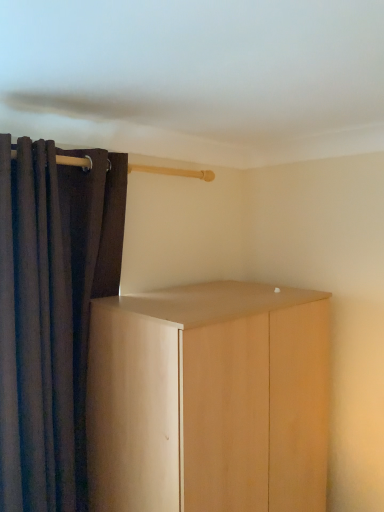
The image size is (384, 512). What are the coordinates of `dark fabric curtain at left` in the screenshot? It's located at (52, 312).

The height and width of the screenshot is (512, 384). What do you see at coordinates (52, 312) in the screenshot?
I see `dark fabric curtain at left` at bounding box center [52, 312].

Where is `light wood cupboard at center`? Image resolution: width=384 pixels, height=512 pixels. light wood cupboard at center is located at coordinates (209, 399).

From the picture: What is the approximate width of light wood cupboard at center?

The width of light wood cupboard at center is 22.03 inches.

What do you see at coordinates (209, 399) in the screenshot? This screenshot has width=384, height=512. I see `light wood cupboard at center` at bounding box center [209, 399].

This screenshot has width=384, height=512. I want to click on dark fabric curtain at left, so click(x=52, y=312).

Considering the relative positions of dark fabric curtain at left and light wood cupboard at center in the image provided, is dark fabric curtain at left to the right of light wood cupboard at center from the viewer's perspective?

In fact, dark fabric curtain at left is to the left of light wood cupboard at center.

Is dark fabric curtain at left closer to the viewer compared to light wood cupboard at center?

No, it is behind light wood cupboard at center.

Is point (63, 334) closer or farther from the camera than point (264, 446)?

Point (63, 334) is closer to the camera than point (264, 446).

From the image's perspective, which object appears higher, dark fabric curtain at left or light wood cupboard at center?

dark fabric curtain at left.

From a real-world perspective, is dark fabric curtain at left positioned over light wood cupboard at center based on gravity?

Yes, from a real-world perspective, dark fabric curtain at left is on top of light wood cupboard at center.

Considering the relative sizes of dark fabric curtain at left and light wood cupboard at center in the image provided, is dark fabric curtain at left thinner than light wood cupboard at center?

Yes.

Which of these two, dark fabric curtain at left or light wood cupboard at center, stands taller?

dark fabric curtain at left is taller.

In terms of size, does dark fabric curtain at left appear bigger or smaller than light wood cupboard at center?

dark fabric curtain at left is smaller than light wood cupboard at center.

Is dark fabric curtain at left surrounding light wood cupboard at center?

No, dark fabric curtain at left does not contain light wood cupboard at center.

Is dark fabric curtain at left next to light wood cupboard at center and touching it?

No, dark fabric curtain at left is not making contact with light wood cupboard at center.

Is light wood cupboard at center at the back of dark fabric curtain at left?

No, dark fabric curtain at left's orientation is not away from light wood cupboard at center.

Can you tell me how much dark fabric curtain at left and light wood cupboard at center differ in facing direction?

The angle between the facing direction of dark fabric curtain at left and the facing direction of light wood cupboard at center is 0.367 degrees.

How much distance is there between dark fabric curtain at left and light wood cupboard at center?

They are 15.68 inches apart.

This screenshot has height=512, width=384. I want to click on cupboard in front of the dark fabric curtain at left, so click(x=209, y=399).

Does light wood cupboard at center appear on the left side of dark fabric curtain at left?

No, light wood cupboard at center is not to the left of dark fabric curtain at left.

Relative to dark fabric curtain at left, is light wood cupboard at center in front or behind?

light wood cupboard at center is positioned closer to the viewer than dark fabric curtain at left.

Considering the positions of points (280, 485) and (85, 300), is point (280, 485) closer to camera compared to point (85, 300)?

No, (280, 485) is behind (85, 300).

In the scene shown: From the image's perspective, is light wood cupboard at center on dark fabric curtain at left?

No.

From a real-world perspective, does light wood cupboard at center stand above dark fabric curtain at left?

No, from a real-world perspective, light wood cupboard at center is not on top of dark fabric curtain at left.

Can you confirm if light wood cupboard at center is thinner than dark fabric curtain at left?

No, light wood cupboard at center is not thinner than dark fabric curtain at left.

Does light wood cupboard at center have a greater height compared to dark fabric curtain at left?

No.

Looking at the image, does light wood cupboard at center seem bigger or smaller compared to dark fabric curtain at left?

light wood cupboard at center is bigger than dark fabric curtain at left.

Looking at this image, which is correct: light wood cupboard at center is inside dark fabric curtain at left, or outside of it?

light wood cupboard at center lies outside dark fabric curtain at left.

Is light wood cupboard at center far away from dark fabric curtain at left?

No, there isn't a large distance between light wood cupboard at center and dark fabric curtain at left.

Is dark fabric curtain at left at the back of light wood cupboard at center?

No, light wood cupboard at center is not facing away from dark fabric curtain at left.

How different are the orientations of light wood cupboard at center and dark fabric curtain at left in degrees?

The facing directions of light wood cupboard at center and dark fabric curtain at left are 0.367 degrees apart.

Locate an element on the screen. The width and height of the screenshot is (384, 512). cupboard to the right of dark fabric curtain at left is located at coordinates (209, 399).

At what (x,y) coordinates should I click in order to perform the action: click on cupboard on the right of dark fabric curtain at left. Please return your answer as a coordinate pair (x, y). The width and height of the screenshot is (384, 512). Looking at the image, I should click on (209, 399).

The width and height of the screenshot is (384, 512). Identify the location of curtain behind the light wood cupboard at center. (52, 312).